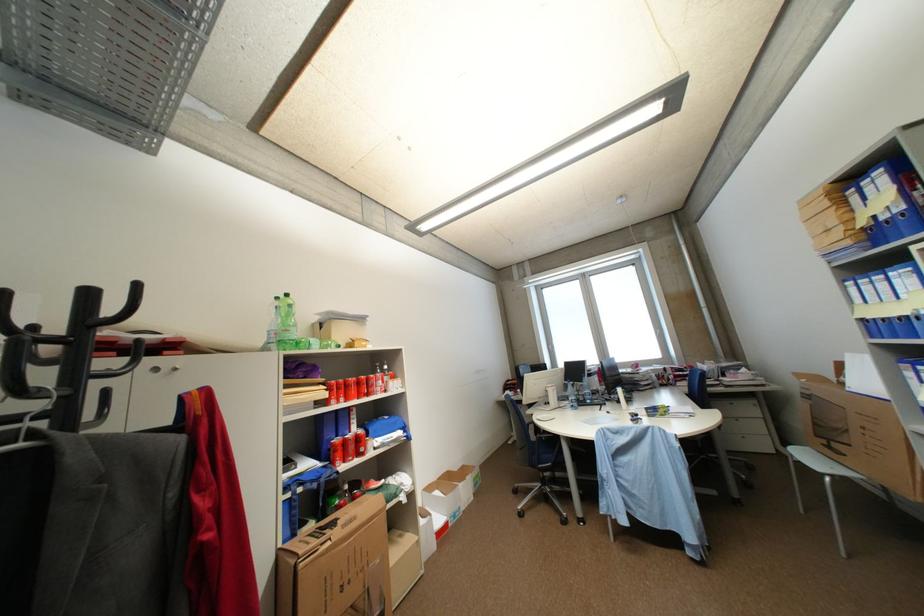
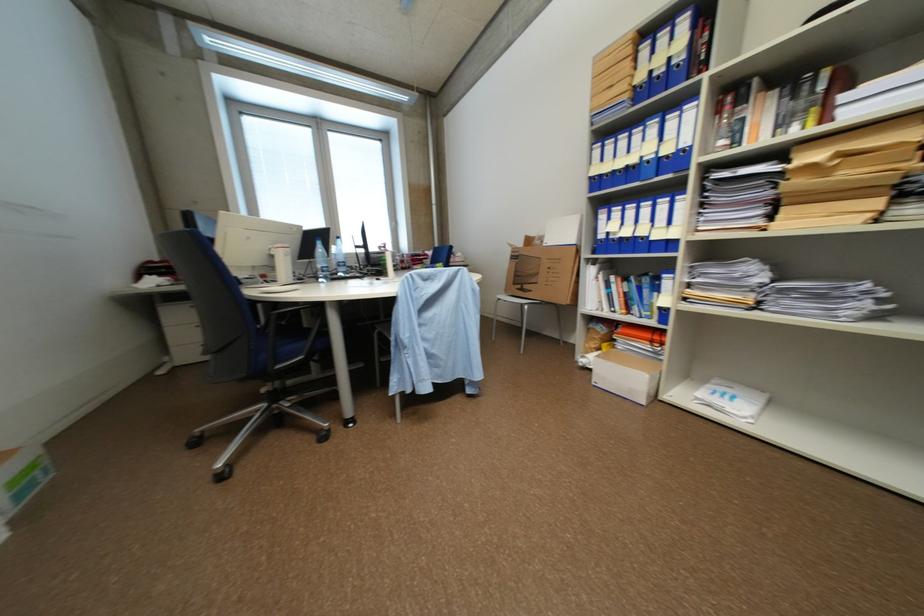
Locate, in the second image, the point that corresponds to (483,487) in the first image.

(28, 496)